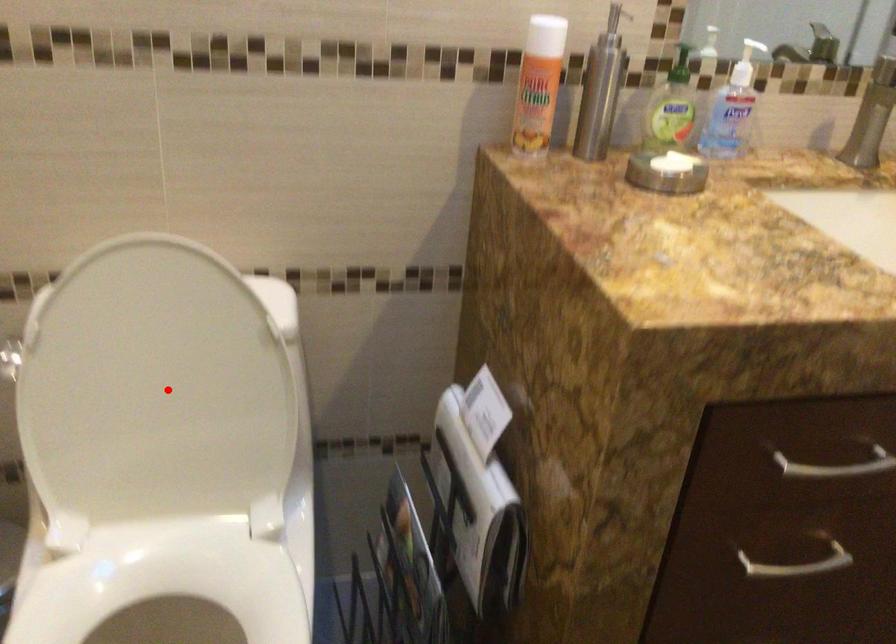
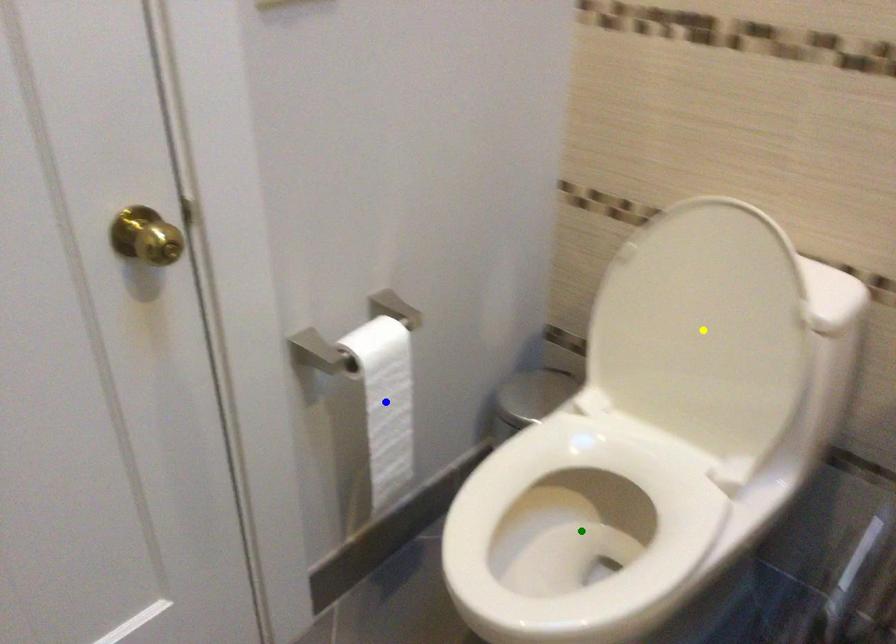
Question: I am providing you with two images of the same scene from different viewpoints. A red point is marked on the first image. You are given multiple points on the second image. Which spot in image 2 lines up with the point in image 1?

Choices:
 (A) yellow point
 (B) blue point
 (C) green point

Answer: (A)